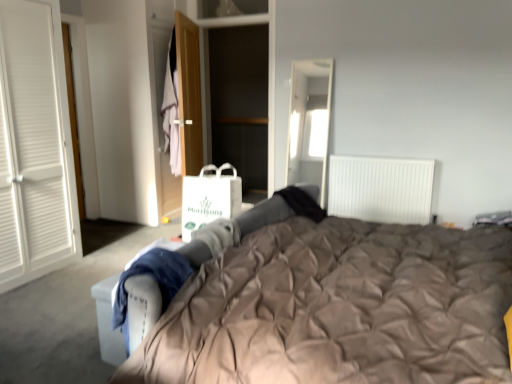
Question: From a real-world perspective, is matte brown duvet at center located higher than white paper shopping bag at center?

Choices:
 (A) yes
 (B) no

Answer: (B)

Question: Is matte brown duvet at center turned away from white paper shopping bag at center?

Choices:
 (A) yes
 (B) no

Answer: (A)

Question: Is white paper shopping bag at center surrounded by matte brown duvet at center?

Choices:
 (A) no
 (B) yes

Answer: (A)

Question: From the image's perspective, would you say matte brown duvet at center is shown under white paper shopping bag at center?

Choices:
 (A) no
 (B) yes

Answer: (B)

Question: Is matte brown duvet at center smaller than white paper shopping bag at center?

Choices:
 (A) yes
 (B) no

Answer: (B)

Question: Would you say light pink fabric at center is to the left or to the right of matte brown duvet at center in the picture?

Choices:
 (A) left
 (B) right

Answer: (A)

Question: In terms of height, does light pink fabric at center look taller or shorter compared to matte brown duvet at center?

Choices:
 (A) short
 (B) tall

Answer: (A)

Question: From a real-world perspective, is light pink fabric at center above or below matte brown duvet at center?

Choices:
 (A) below
 (B) above

Answer: (B)

Question: Relative to matte brown duvet at center, is light pink fabric at center in front or behind?

Choices:
 (A) behind
 (B) front

Answer: (A)

Question: Considering the relative positions of light pink fabric at center and white paper shopping bag at center in the image provided, is light pink fabric at center to the left or to the right of white paper shopping bag at center?

Choices:
 (A) left
 (B) right

Answer: (A)

Question: In terms of size, does light pink fabric at center appear bigger or smaller than white paper shopping bag at center?

Choices:
 (A) big
 (B) small

Answer: (B)

Question: Choose the correct answer: Is light pink fabric at center inside white paper shopping bag at center or outside it?

Choices:
 (A) inside
 (B) outside

Answer: (B)

Question: From the image's perspective, relative to white paper shopping bag at center, is light pink fabric at center above or below?

Choices:
 (A) below
 (B) above

Answer: (B)

Question: Is wooden door at center taller or shorter than light pink fabric at center?

Choices:
 (A) short
 (B) tall

Answer: (B)

Question: Based on their sizes in the image, would you say wooden door at center is bigger or smaller than light pink fabric at center?

Choices:
 (A) big
 (B) small

Answer: (A)